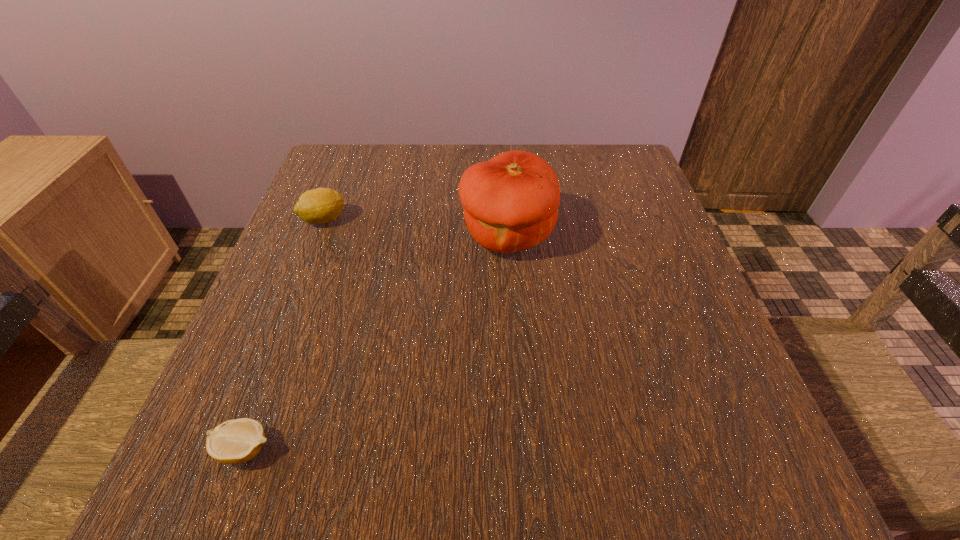
The height and width of the screenshot is (540, 960). In order to click on blank region between the nearer lemon and the pumpkin in this screenshot , I will do `click(375, 342)`.

At what (x,y) coordinates should I click in order to perform the action: click on unoccupied area between the pumpkin and the shortest object. Please return your answer as a coordinate pair (x, y). Looking at the image, I should click on (375, 342).

Locate an element on the screen. unoccupied position between the farther lemon and the shortest object is located at coordinates (284, 334).

Where is `empty space between the farther lemon and the tallest object`? This screenshot has width=960, height=540. empty space between the farther lemon and the tallest object is located at coordinates tap(416, 227).

Locate an element on the screen. This screenshot has height=540, width=960. vacant space that's between the second shortest object and the nearer lemon is located at coordinates (284, 334).

The width and height of the screenshot is (960, 540). In order to click on free space between the nearest object and the taller lemon in this screenshot , I will do `click(284, 334)`.

Find the location of `unoccupied position between the farther lemon and the tallest object`. unoccupied position between the farther lemon and the tallest object is located at coordinates (416, 227).

You are a GUI agent. You are given a task and a screenshot of the screen. Output one action in this format:
    pyautogui.click(x=<x>, y=<y>)
    Task: Click on the object that is the second closest to the pumpkin
    This screenshot has height=540, width=960.
    Given the screenshot: What is the action you would take?
    pyautogui.click(x=237, y=441)

The height and width of the screenshot is (540, 960). In order to click on object that can be found as the second closest to the second tallest object in this screenshot , I will do `click(237, 441)`.

Locate an element on the screen. The height and width of the screenshot is (540, 960). vacant space that satisfies the following two spatial constraints: 1. at the stem end of the second tallest object; 2. on the right side of the nearest object is located at coordinates (234, 449).